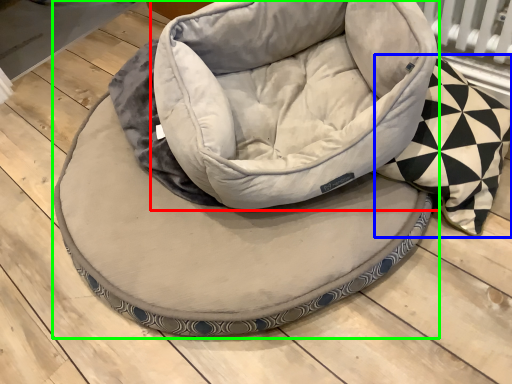
Question: Which object is the farthest from bean bag chair (highlighted by a red box)? Choose among these: throw pillow (highlighted by a blue box) or dog bed (highlighted by a green box).

Choices:
 (A) throw pillow
 (B) dog bed

Answer: (A)